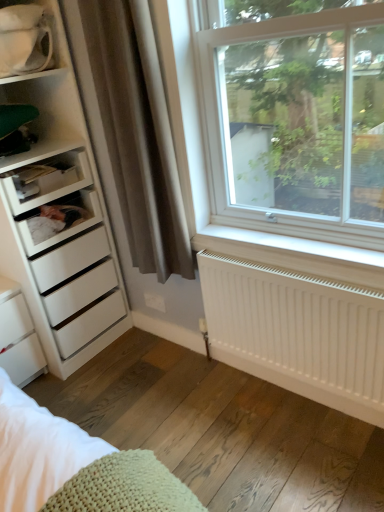
Question: Is white matte radiator at lower right not inside white plastic shelf at left, the 2th shelf from the top?

Choices:
 (A) no
 (B) yes

Answer: (B)

Question: Is white matte radiator at lower right positioned before white plastic shelf at left, the 2th shelf from the top?

Choices:
 (A) no
 (B) yes

Answer: (B)

Question: Can you confirm if white matte radiator at lower right is wider than white plastic shelf at left, the 2th shelf from the top?

Choices:
 (A) no
 (B) yes

Answer: (A)

Question: Is white matte radiator at lower right smaller than white plastic shelf at left, the 2th shelf from the top?

Choices:
 (A) yes
 (B) no

Answer: (B)

Question: Is white matte radiator at lower right to the right of white plastic shelf at left, the 2th shelf from the top, from the viewer's perspective?

Choices:
 (A) no
 (B) yes

Answer: (B)

Question: Is white matte radiator at lower right situated inside white matte chest of drawers at lower left or outside?

Choices:
 (A) outside
 (B) inside

Answer: (A)

Question: In terms of size, does white matte radiator at lower right appear bigger or smaller than white matte chest of drawers at lower left?

Choices:
 (A) big
 (B) small

Answer: (B)

Question: Would you say white matte radiator at lower right is to the left or to the right of white matte chest of drawers at lower left in the picture?

Choices:
 (A) right
 (B) left

Answer: (A)

Question: Considering their positions, is white matte radiator at lower right located in front of or behind white matte chest of drawers at lower left?

Choices:
 (A) front
 (B) behind

Answer: (A)

Question: Is white plastic window at upper right situated inside white matte radiator at lower right or outside?

Choices:
 (A) inside
 (B) outside

Answer: (B)

Question: From a real-world perspective, is white plastic window at upper right physically located above or below white matte radiator at lower right?

Choices:
 (A) above
 (B) below

Answer: (A)

Question: Based on their sizes in the image, would you say white plastic window at upper right is bigger or smaller than white matte radiator at lower right?

Choices:
 (A) small
 (B) big

Answer: (B)

Question: Considering the positions of white plastic window at upper right and white matte radiator at lower right in the image, is white plastic window at upper right taller or shorter than white matte radiator at lower right?

Choices:
 (A) short
 (B) tall

Answer: (B)

Question: From a real-world perspective, is white matte radiator at lower right above or below white glossy mug at upper left, which is the 1th shelf in top-to-bottom order?

Choices:
 (A) below
 (B) above

Answer: (A)

Question: From the image's perspective, relative to white glossy mug at upper left, which is the 1th shelf in top-to-bottom order, is white matte radiator at lower right above or below?

Choices:
 (A) below
 (B) above

Answer: (A)